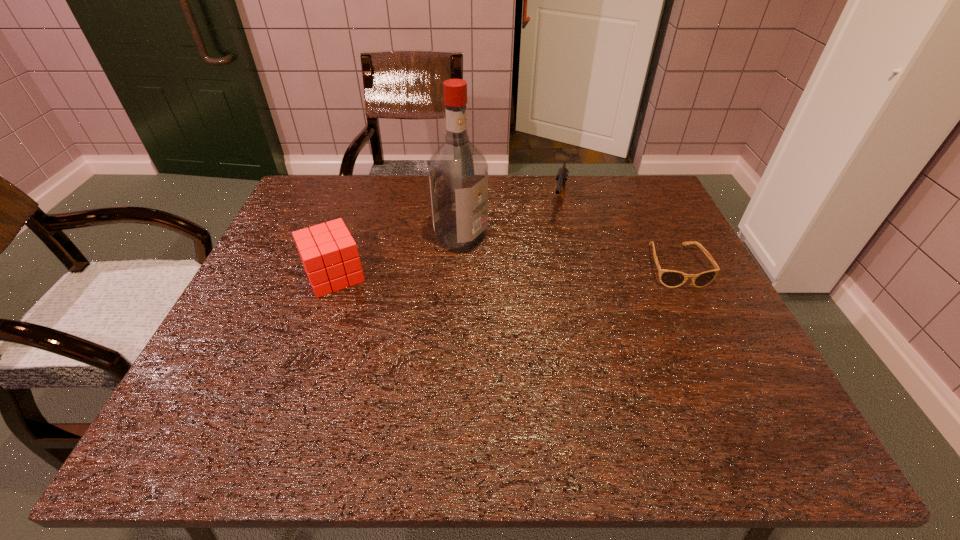
This screenshot has height=540, width=960. I want to click on free space on the desktop that is between the leftmost object and the sunglasses and is positioned on the front-facing side of the liquor, so click(x=537, y=270).

Locate an element on the screen. Image resolution: width=960 pixels, height=540 pixels. vacant space on the desktop that is between the cube and the rightmost object and is positioned along the barrel of the gun is located at coordinates (542, 269).